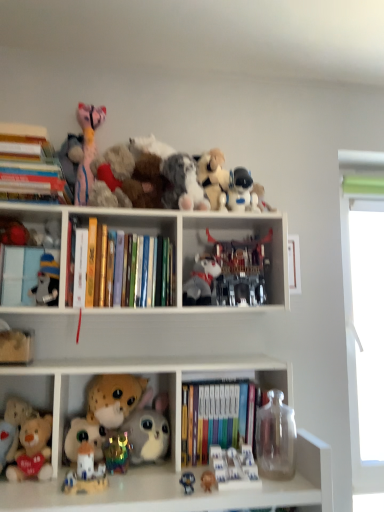
Question: Can you confirm if transparent glass vase at lower right, which is counted as the 14th toy, starting from the left, is shorter than gold paper at upper center?

Choices:
 (A) yes
 (B) no

Answer: (A)

Question: Is gold paper at upper center at the back of transparent glass vase at lower right, which is counted as the 14th toy, starting from the left?

Choices:
 (A) yes
 (B) no

Answer: (B)

Question: Is transparent glass vase at lower right, which is counted as the 14th toy, starting from the left, further to the viewer compared to gold paper at upper center?

Choices:
 (A) no
 (B) yes

Answer: (A)

Question: Does transparent glass vase at lower right, placed as the first toy when sorted from right to left, have a larger size compared to gold paper at upper center?

Choices:
 (A) no
 (B) yes

Answer: (B)

Question: Considering the relative positions of transparent glass vase at lower right, placed as the first toy when sorted from right to left, and gold paper at upper center in the image provided, is transparent glass vase at lower right, placed as the first toy when sorted from right to left, to the right of gold paper at upper center from the viewer's perspective?

Choices:
 (A) yes
 (B) no

Answer: (A)

Question: Does transparent glass vase at lower right, which is counted as the 14th toy, starting from the left, have a greater height compared to gold paper at upper center?

Choices:
 (A) yes
 (B) no

Answer: (B)

Question: Is fluffy plush toy at upper center, the seventh toy viewed from the right, shorter than green fabric at right?

Choices:
 (A) yes
 (B) no

Answer: (A)

Question: From a real-world perspective, is fluffy plush toy at upper center, arranged as the 8th toy when viewed from the left, positioned over green fabric at right based on gravity?

Choices:
 (A) yes
 (B) no

Answer: (A)

Question: Does fluffy plush toy at upper center, the seventh toy viewed from the right, have a smaller size compared to green fabric at right?

Choices:
 (A) no
 (B) yes

Answer: (B)

Question: Is fluffy plush toy at upper center, arranged as the 8th toy when viewed from the left, further to camera compared to green fabric at right?

Choices:
 (A) yes
 (B) no

Answer: (B)

Question: Is fluffy plush toy at upper center, arranged as the 8th toy when viewed from the left, positioned with its back to green fabric at right?

Choices:
 (A) no
 (B) yes

Answer: (A)

Question: Does white matte bookshelf at upper center, the 1th shelf positioned from the top, have a lesser width compared to rainbow plastic toy at lower center, arranged as the 8th toy when viewed from the right?

Choices:
 (A) yes
 (B) no

Answer: (B)